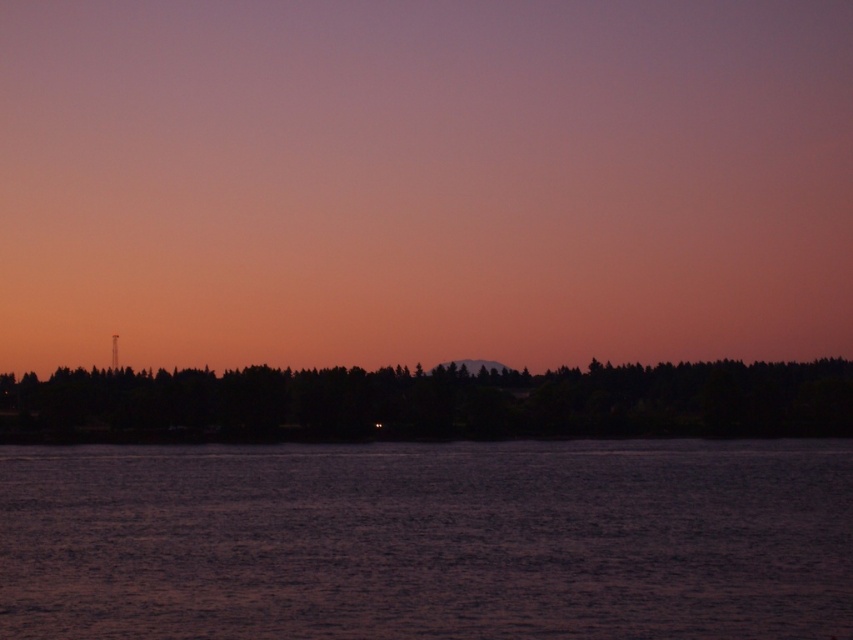
Does dark purple water at center appear on the left side of dark green trees at center?

No, dark purple water at center is not to the left of dark green trees at center.

Can you confirm if dark purple water at center is positioned above dark green trees at center?

No.

Does point (712, 637) come in front of point (183, 428)?

Yes, it is.

You are a GUI agent. You are given a task and a screenshot of the screen. Output one action in this format:
    pyautogui.click(x=<x>, y=<y>)
    Task: Click on the dark purple water at center
    The width and height of the screenshot is (853, 640).
    Given the screenshot: What is the action you would take?
    pyautogui.click(x=428, y=540)